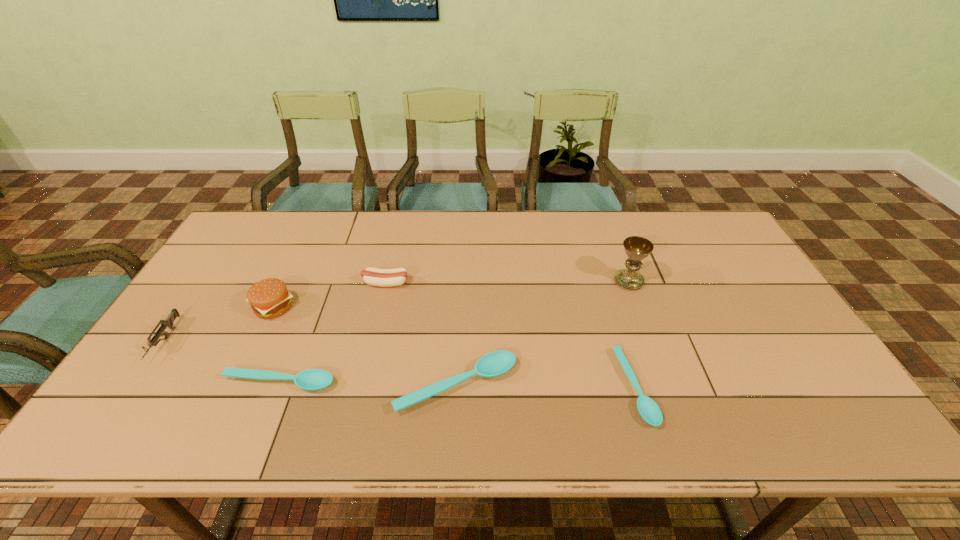
Please point a spot to add another spoon on the right. Please provide its 2D coordinates. Your answer should be formatted as a tuple, i.e. [(x, y)], where the tuple contains the x and y coordinates of a point satisfying the conditions above.

[(815, 389)]